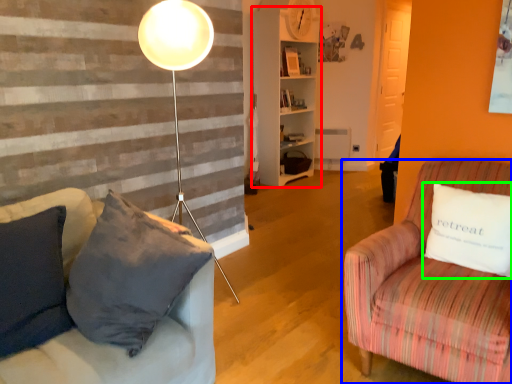
Question: Estimate the real-world distances between objects in this image. Which object is farther from shelf (highlighted by a red box), studio couch (highlighted by a blue box) or pillow (highlighted by a green box)?

Choices:
 (A) studio couch
 (B) pillow

Answer: (B)